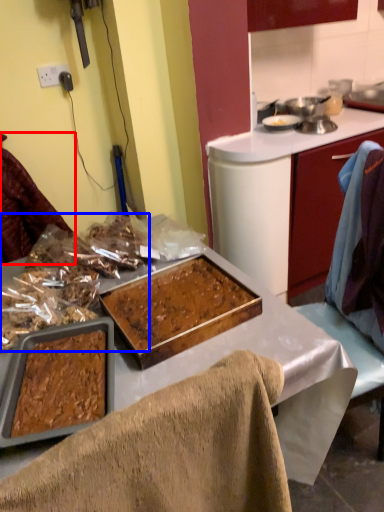
Question: Which object is closer to the camera taking this photo, leftover (highlighted by a red box) or food (highlighted by a blue box)?

Choices:
 (A) leftover
 (B) food

Answer: (B)